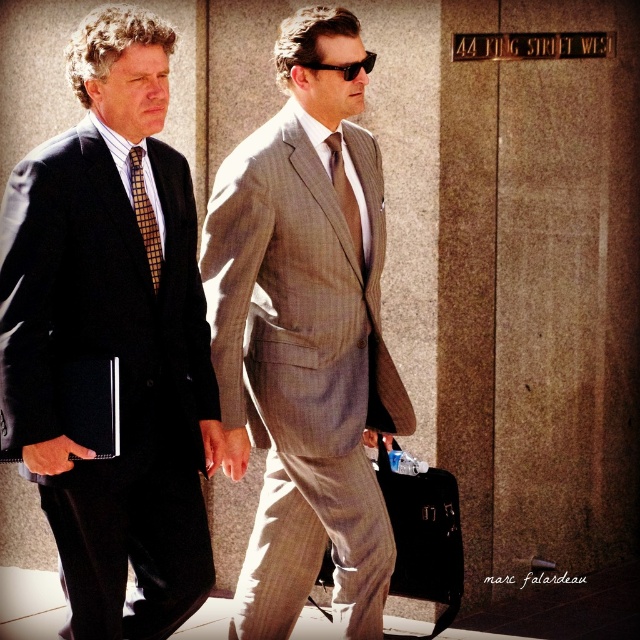
Question: Which point appears farthest from the camera in this image?

Choices:
 (A) (22, 273)
 (B) (372, 192)
 (C) (330, 160)

Answer: (B)

Question: Which of the following is the farthest from the observer?

Choices:
 (A) (93, 52)
 (B) (353, 237)

Answer: (B)

Question: Does checkered fabric tie at left have a greater width compared to black plastic sunglasses at center?

Choices:
 (A) no
 (B) yes

Answer: (A)

Question: Is matte black suit at left smaller than gray pinstripe suit at center?

Choices:
 (A) no
 (B) yes

Answer: (B)

Question: Which point is farther to the camera?

Choices:
 (A) (332, 157)
 (B) (113, 58)

Answer: (A)

Question: Considering the relative positions of checkered fabric tie at left and brown woven tie at center in the image provided, where is checkered fabric tie at left located with respect to brown woven tie at center?

Choices:
 (A) right
 (B) left

Answer: (B)